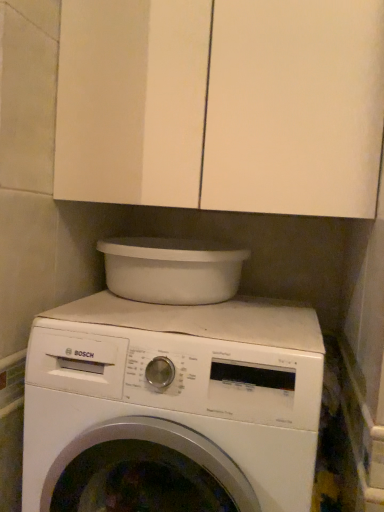
Where is `white plastic basin at upper center`? The height and width of the screenshot is (512, 384). white plastic basin at upper center is located at coordinates click(x=171, y=270).

In order to click on white plastic basin at upper center in this screenshot , I will do `click(171, 270)`.

From a real-world perspective, is white matte cabinet at upper center beneath white plastic basin at upper center?

No.

Between white matte cabinet at upper center and white plastic basin at upper center, which one has larger size?

Bigger between the two is white matte cabinet at upper center.

Is white matte cabinet at upper center not close to white plastic basin at upper center?

Actually, white matte cabinet at upper center and white plastic basin at upper center are a little close together.

At what (x,y) coordinates should I click in order to perform the action: click on appliance on the left of white matte cabinet at upper center. Please return your answer as a coordinate pair (x, y). Looking at the image, I should click on (171, 270).

Does white plastic basin at upper center have a greater height compared to white matte cabinet at upper center?

In fact, white plastic basin at upper center may be shorter than white matte cabinet at upper center.

Which object is closer to the camera taking this photo, white plastic basin at upper center or white matte cabinet at upper center?

white matte cabinet at upper center is closer to the camera.

What's the angular difference between white plastic basin at upper center and white matte cabinet at upper center's facing directions?

They differ by 0.668 degrees in their facing directions.

Which of these two, white matte cabinet at upper center or white matte washing machine at center, is bigger?

With larger size is white matte washing machine at center.

Are white matte cabinet at upper center and white matte washing machine at center beside each other?

No, white matte cabinet at upper center is not beside white matte washing machine at center.

Is white matte cabinet at upper center facing away from white matte washing machine at center?

white matte cabinet at upper center does not have its back to white matte washing machine at center.

Measure the distance from white matte cabinet at upper center to white matte washing machine at center.

A distance of 17.84 inches exists between white matte cabinet at upper center and white matte washing machine at center.

Is white matte washing machine at center positioned with its back to white plastic basin at upper center?

No, white matte washing machine at center is not facing the opposite direction of white plastic basin at upper center.

Are white matte washing machine at center and white plastic basin at upper center located far from each other?

Actually, white matte washing machine at center and white plastic basin at upper center are a little close together.

Which object is positioned more to the left, white matte washing machine at center or white plastic basin at upper center?

white plastic basin at upper center.

From the image's perspective, between white matte washing machine at center and white plastic basin at upper center, which one is located above?

white plastic basin at upper center, from the image's perspective.

From the image's perspective, which one is positioned lower, white plastic basin at upper center or white matte washing machine at center?

white matte washing machine at center is shown below in the image.

How many degrees apart are the facing directions of white plastic basin at upper center and white matte washing machine at center?

5.79e-06 degrees separate the facing orientations of white plastic basin at upper center and white matte washing machine at center.

Does white plastic basin at upper center contain white matte washing machine at center?

That's incorrect, white matte washing machine at center is not inside white plastic basin at upper center.

Is white plastic basin at upper center to the left of white matte washing machine at center from the viewer's perspective?

Answer: Yes, white plastic basin at upper center is to the left of white matte washing machine at center.

Is white matte washing machine at center looking in the opposite direction of white matte cabinet at upper center?

white matte washing machine at center does not have its back to white matte cabinet at upper center.

Is white matte washing machine at center not within white matte cabinet at upper center?

white matte washing machine at center lies outside white matte cabinet at upper center's area.

Is white matte washing machine at center touching white matte cabinet at upper center?

No, white matte washing machine at center is not with white matte cabinet at upper center.

I want to click on cabinetry above the white plastic basin at upper center (from a real-world perspective), so click(x=222, y=104).

Find the location of a particular element. The image size is (384, 512). appliance behind the white matte cabinet at upper center is located at coordinates (171, 270).

Estimate the real-world distances between objects in this image. Which object is closer to white matte washing machine at center, white plastic basin at upper center or white matte cabinet at upper center?

white plastic basin at upper center is positioned closer to the anchor white matte washing machine at center.

Which object lies further to the anchor point white plastic basin at upper center, white matte cabinet at upper center or white matte washing machine at center?

white matte cabinet at upper center is positioned further to the anchor white plastic basin at upper center.

Considering their positions, is white plastic basin at upper center positioned further to white matte cabinet at upper center than white matte washing machine at center?

white matte washing machine at center is positioned further to the anchor white matte cabinet at upper center.

From the picture: Based on their spatial positions, is white matte cabinet at upper center or white plastic basin at upper center further from white matte washing machine at center?

Among the two, white matte cabinet at upper center is located further to white matte washing machine at center.

Considering their positions, is white matte washing machine at center positioned further to white plastic basin at upper center than white matte cabinet at upper center?

The object further to white plastic basin at upper center is white matte cabinet at upper center.

From the image, which object appears to be farther from white matte cabinet at upper center, white matte washing machine at center or white plastic basin at upper center?

Among the two, white matte washing machine at center is located further to white matte cabinet at upper center.

You are a GUI agent. You are given a task and a screenshot of the screen. Output one action in this format:
    pyautogui.click(x=<x>, y=<y>)
    Task: Click on the appliance between white matte cabinet at upper center and white matte washing machine at center in the up-down direction
    The width and height of the screenshot is (384, 512).
    Given the screenshot: What is the action you would take?
    pyautogui.click(x=171, y=270)